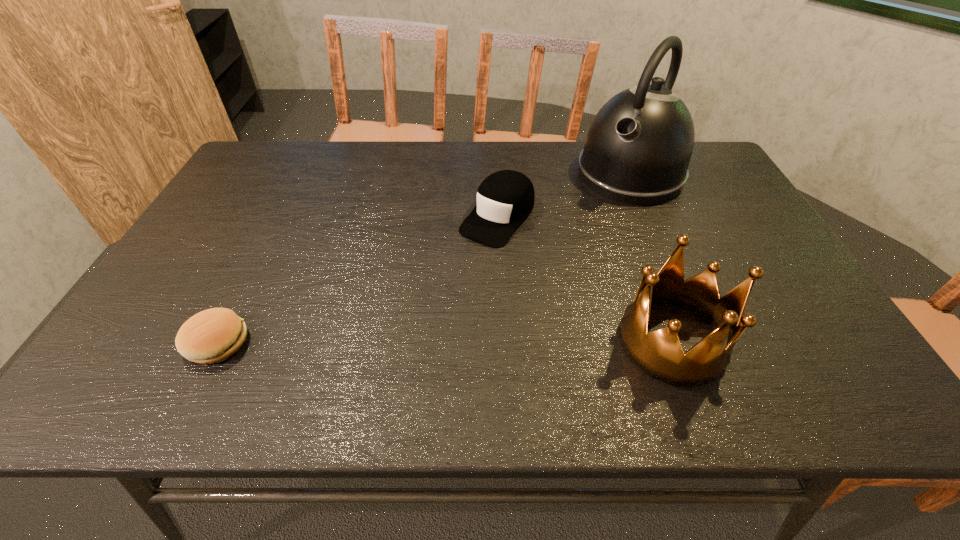
In order to click on vacant space on the desktop that is between the leftmost object and the second tallest object and is positioned on the front-facing side of the third object from right to left in this screenshot , I will do [387, 342].

Find the location of `free space on the desktop that is between the shortest object and the crown and is positioned on the spout of the tallest object`. free space on the desktop that is between the shortest object and the crown and is positioned on the spout of the tallest object is located at coordinates (479, 342).